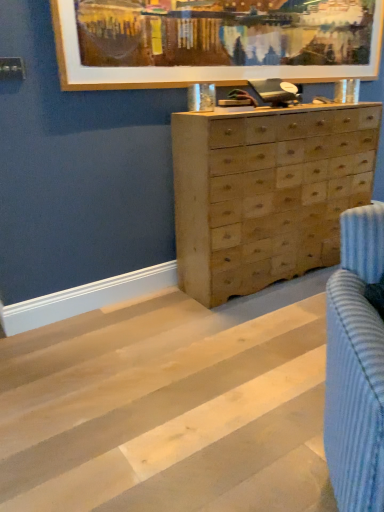
Question: Is natural wood chest of drawers at center in front of or behind wooden frame at upper center in the image?

Choices:
 (A) front
 (B) behind

Answer: (B)

Question: From a real-world perspective, relative to wooden frame at upper center, is natural wood chest of drawers at center vertically above or below?

Choices:
 (A) above
 (B) below

Answer: (B)

Question: Estimate the real-world distances between objects in this image. Which object is closer to the natural wood chest of drawers at center?

Choices:
 (A) natural wood floor at center
 (B) wooden frame at upper center

Answer: (B)

Question: Which of these objects is positioned farthest from the natural wood floor at center?

Choices:
 (A) wooden frame at upper center
 (B) natural wood chest of drawers at center

Answer: (A)